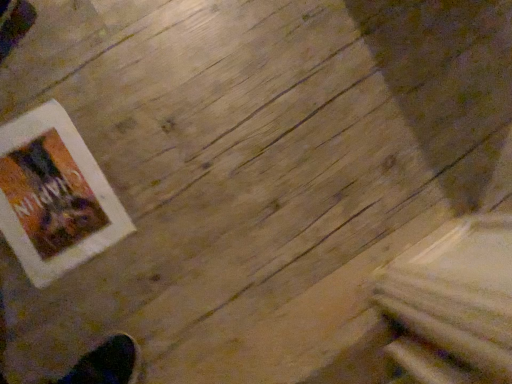
Where is `unoccupied region to the right of white matte picture frame at lower left`? unoccupied region to the right of white matte picture frame at lower left is located at coordinates (161, 235).